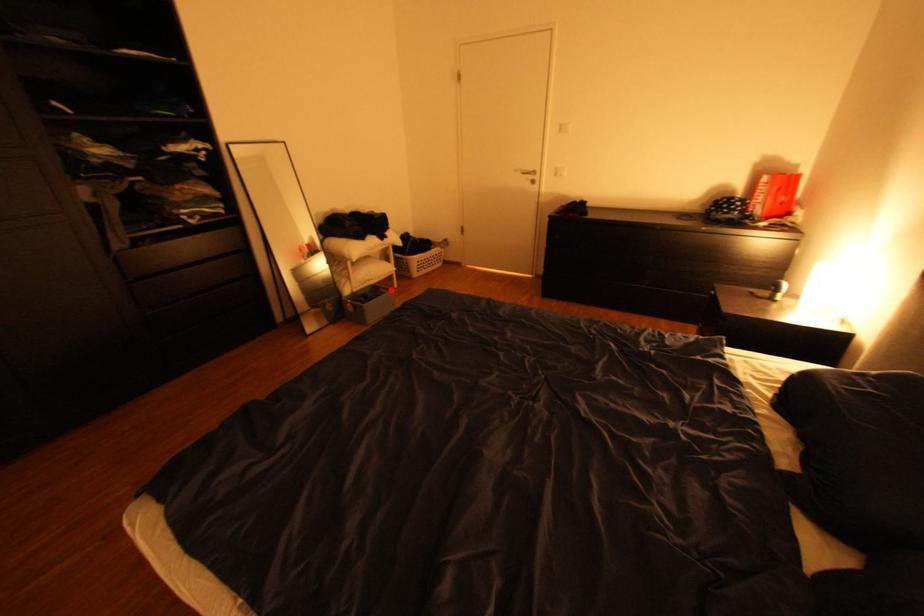
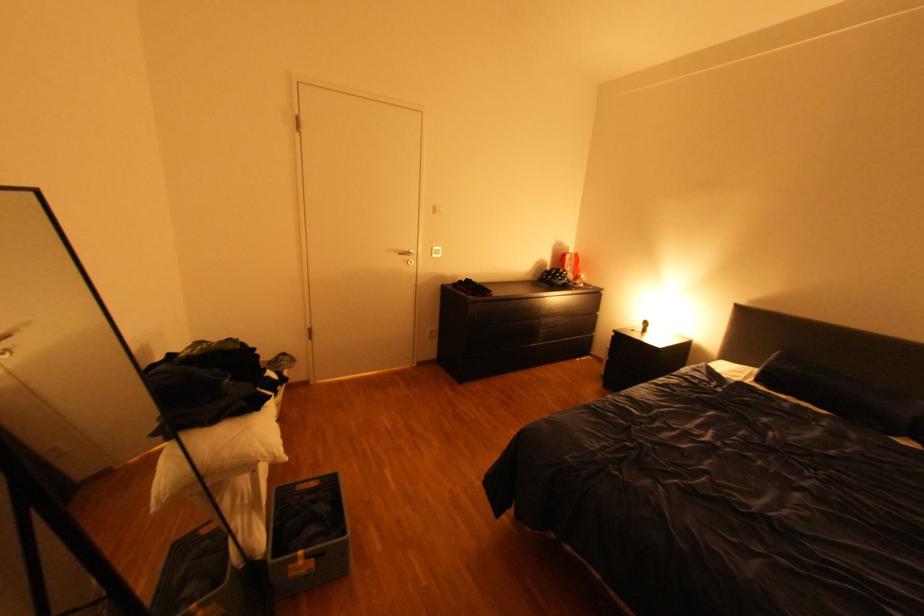
Question: A red point is marked in image1. In image2, is the corresponding 3D point closer to the camera or farther? Reply with the corresponding letter.

Choices:
 (A) The corresponding 3D point is closer.
 (B) The corresponding 3D point is farther.

Answer: (A)